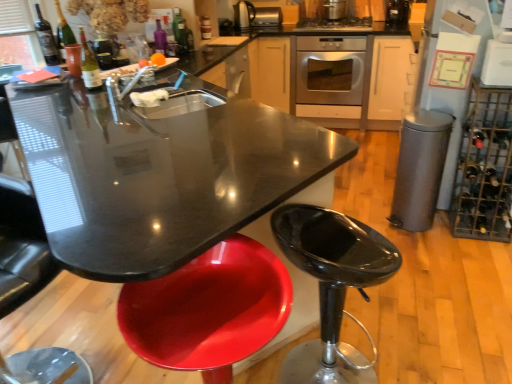
Question: Is matte glass bottle at center, the 3th bottle from the front, positioned behind white glossy refrigerator at upper right, the 2th appliance positioned from the bottom?

Choices:
 (A) no
 (B) yes

Answer: (B)

Question: Would you say matte glass bottle at center, marked as the 3th bottle in a left-to-right arrangement, is a long distance from white glossy refrigerator at upper right, which appears as the 1th appliance when viewed from the right?

Choices:
 (A) no
 (B) yes

Answer: (B)

Question: From the image's perspective, would you say matte glass bottle at center, which ranks as the first bottle in back-to-front order, is shown under white glossy refrigerator at upper right, the first appliance in the front-to-back sequence?

Choices:
 (A) yes
 (B) no

Answer: (B)

Question: From a real-world perspective, is matte glass bottle at center, the 3th bottle from the front, under white glossy refrigerator at upper right, which appears as the 5th appliance when viewed from the left?

Choices:
 (A) no
 (B) yes

Answer: (A)

Question: Is matte glass bottle at center, acting as the first bottle starting from the right, bigger than white glossy refrigerator at upper right, which ranks as the fourth appliance in top-to-bottom order?

Choices:
 (A) yes
 (B) no

Answer: (B)

Question: Is matte glass bottle at center, marked as the 3th bottle in a left-to-right arrangement, positioned before white glossy refrigerator at upper right, the 2th appliance positioned from the bottom?

Choices:
 (A) no
 (B) yes

Answer: (A)

Question: From a real-world perspective, does glossy plastic stool at lower left sit lower than metallic silver kettle at upper center, marked as the 5th appliance in a right-to-left arrangement?

Choices:
 (A) yes
 (B) no

Answer: (A)

Question: From the image's perspective, is glossy plastic stool at lower left located beneath metallic silver kettle at upper center, marked as the second appliance in a back-to-front arrangement?

Choices:
 (A) yes
 (B) no

Answer: (A)

Question: Would you consider glossy plastic stool at lower left to be distant from metallic silver kettle at upper center, the 4th appliance in the bottom-to-top sequence?

Choices:
 (A) yes
 (B) no

Answer: (A)

Question: Considering the relative sizes of glossy plastic stool at lower left and metallic silver kettle at upper center, marked as the second appliance in a back-to-front arrangement, in the image provided, is glossy plastic stool at lower left thinner than metallic silver kettle at upper center, marked as the second appliance in a back-to-front arrangement,?

Choices:
 (A) no
 (B) yes

Answer: (A)

Question: Does glossy plastic stool at lower left have a greater width compared to metallic silver kettle at upper center, marked as the second appliance in a back-to-front arrangement?

Choices:
 (A) yes
 (B) no

Answer: (A)

Question: Is glossy plastic stool at lower left facing towards metallic silver kettle at upper center, marked as the 5th appliance in a right-to-left arrangement?

Choices:
 (A) no
 (B) yes

Answer: (A)

Question: From a real-world perspective, is matte glass wine bottle at upper left, positioned as the second wine bottle in left-to-right order, below metallic stainless steel toaster at upper center, the 5th appliance from the bottom?

Choices:
 (A) no
 (B) yes

Answer: (A)